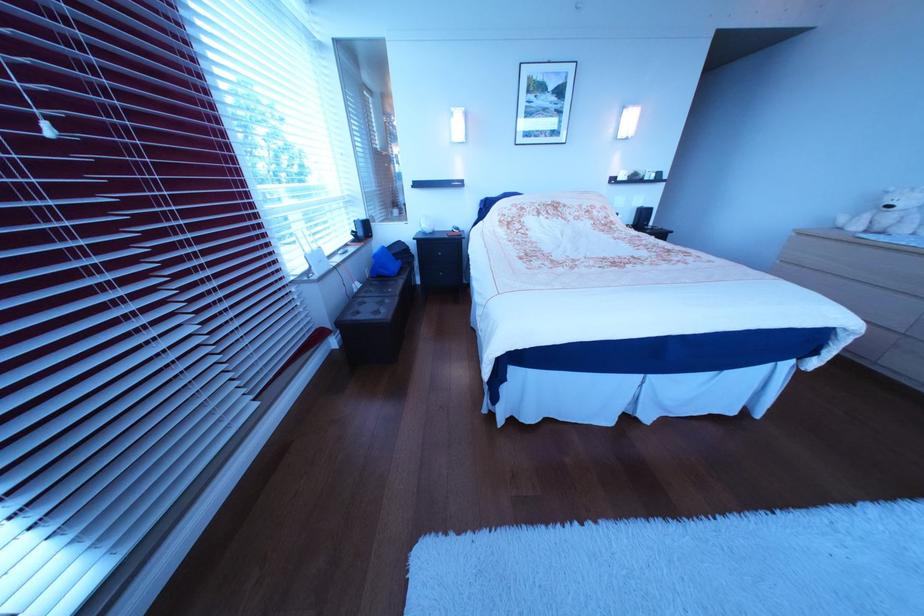
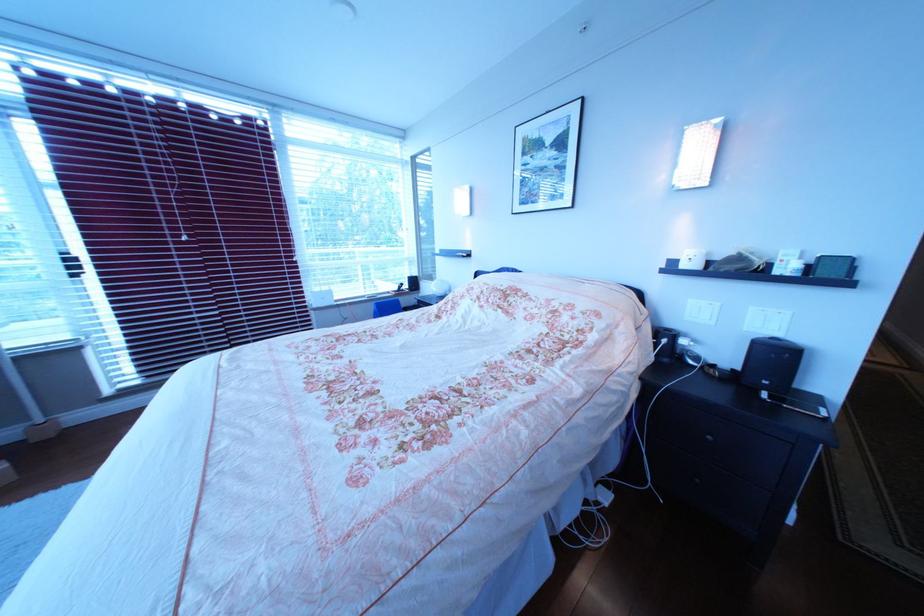
Find the pixel in the second image that matches (650,198) in the first image.

(767, 310)